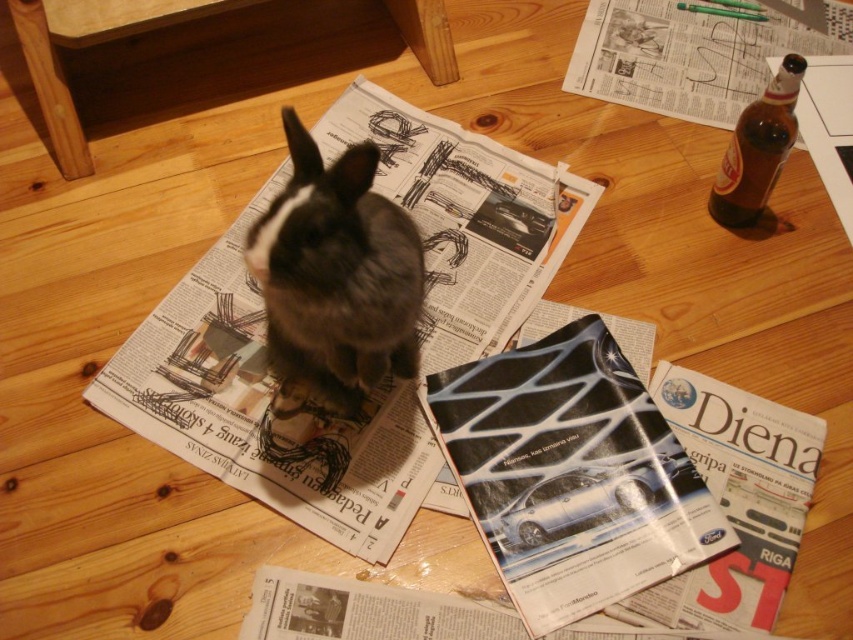
Locate an element on the screen. The height and width of the screenshot is (640, 853). matte black magazine at center is located at coordinates (572, 474).

In the scene shown: Who is lower down, matte black magazine at center or fuzzy brown rabbit at center?

Positioned lower is matte black magazine at center.

Between point (519, 586) and point (392, 269), which one is positioned behind?

The point (519, 586) is behind.

Where is `matte black magazine at center`? Image resolution: width=853 pixels, height=640 pixels. matte black magazine at center is located at coordinates (572, 474).

Which is below, white printed newspaper at center or fuzzy brown rabbit at center?

white printed newspaper at center is below.

Where is `white printed newspaper at center`? The image size is (853, 640). white printed newspaper at center is located at coordinates pos(264,410).

Is white paper at upper right thinner than brown glass bottle at upper right?

No.

Can you confirm if white paper at upper right is positioned above brown glass bottle at upper right?

Yes, white paper at upper right is above brown glass bottle at upper right.

Measure the distance between white paper at upper right and camera.

white paper at upper right is 4.57 feet from camera.

The image size is (853, 640). I want to click on white paper at upper right, so click(695, 51).